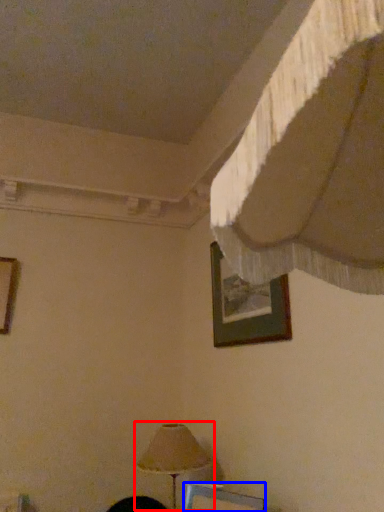
Question: Which point is closer to the camera, lamp (highlighted by a red box) or picture frame (highlighted by a blue box)?

Choices:
 (A) lamp
 (B) picture frame

Answer: (B)